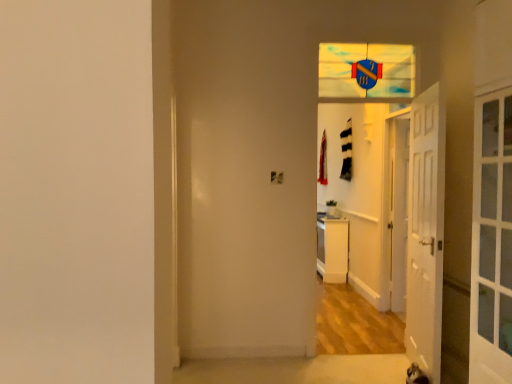
Question: From a real-world perspective, is white glossy door at center, marked as the second door in a left-to-right arrangement, above or below stained glass shield at upper center?

Choices:
 (A) below
 (B) above

Answer: (A)

Question: Would you say white glossy door at center, which is counted as the first door, starting from the right, is to the left or to the right of stained glass shield at upper center in the picture?

Choices:
 (A) right
 (B) left

Answer: (A)

Question: Estimate the real-world distances between objects in this image. Which object is closer to the white wooden door at right, the second door viewed from the right?

Choices:
 (A) white glossy door at center, which is counted as the first door, starting from the right
 (B) white glossy dresser at center
 (C) stained glass shield at upper center

Answer: (A)

Question: Estimate the real-world distances between objects in this image. Which object is closer to the white wooden door at right, placed as the second door when sorted from back to front?

Choices:
 (A) white glossy door at center, the 1th door in the back-to-front sequence
 (B) white glossy dresser at center
 (C) stained glass shield at upper center

Answer: (A)